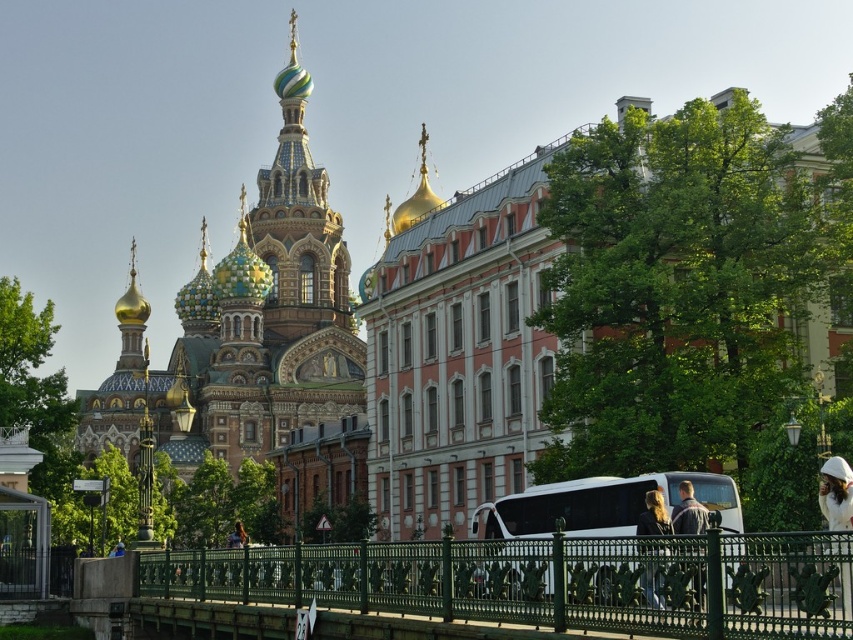
From the picture: You are an architect analyzing the urban layout of this city. You need to determine the vertical relationship between the multicolored mosaic dome at upper left and the green wrought iron bridge at center. Which one is positioned higher in the scene?

The multicolored mosaic dome at upper left is positioned higher than the green wrought iron bridge at center because it is described as being above it.

You are a pedestrian standing at the base of the church and see the white matte helmet at upper right and the blonde hair at lower center. Which object is positioned higher up in the image?

The white matte helmet at upper right is positioned higher up in the image than the blonde hair at lower center.